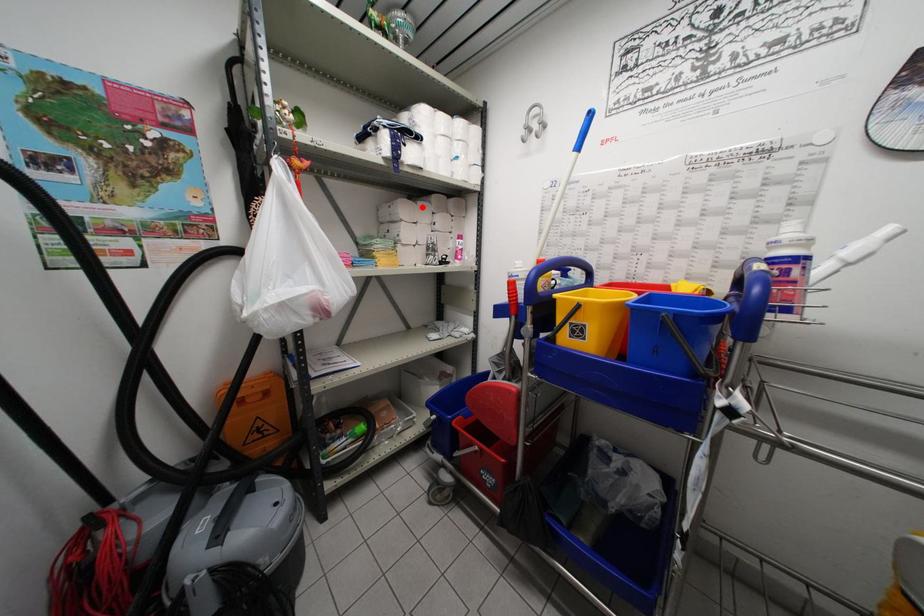
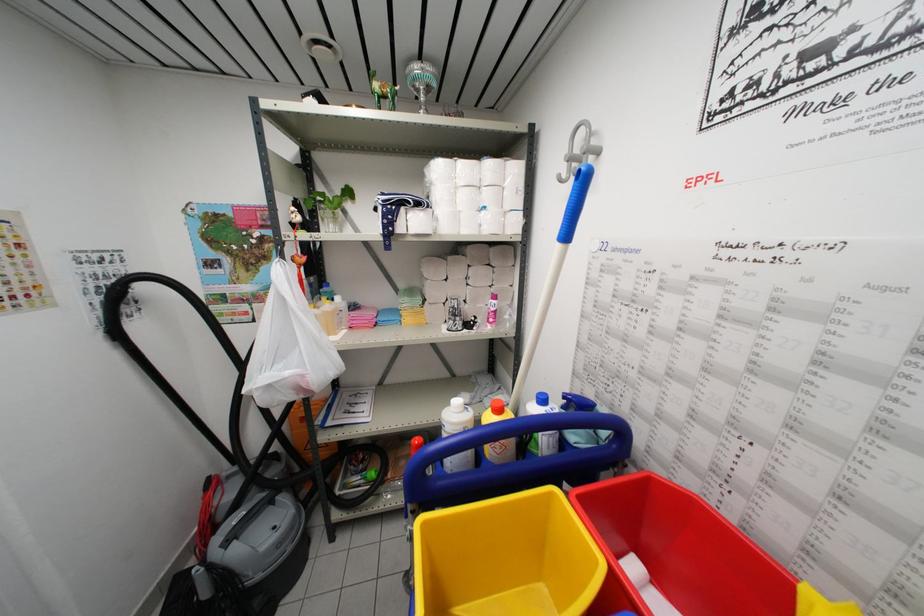
In the second image, find the point that corresponds to the highlighted location in the first image.

(453, 262)